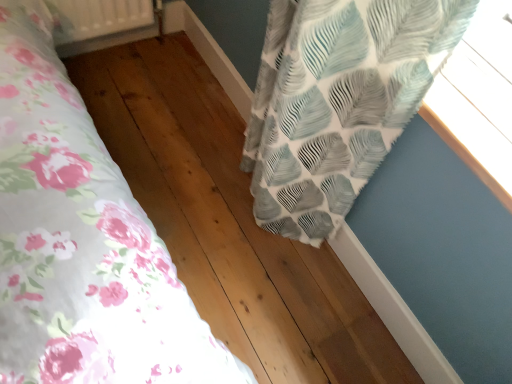
Question: From the image's perspective, is textured white and blue leaf-patterned curtain at upper right located above or below white plastic radiator at upper left?

Choices:
 (A) above
 (B) below

Answer: (B)

Question: Is textured white and blue leaf-patterned curtain at upper right taller or shorter than white plastic radiator at upper left?

Choices:
 (A) short
 (B) tall

Answer: (B)

Question: Estimate the real-world distances between objects in this image. Which object is closer to the white plastic radiator at upper left?

Choices:
 (A) textured white and blue leaf-patterned curtain at upper right
 (B) textured fabric curtain at upper right

Answer: (A)

Question: Which is nearer to the textured fabric curtain at upper right?

Choices:
 (A) white plastic radiator at upper left
 (B) textured white and blue leaf-patterned curtain at upper right

Answer: (B)